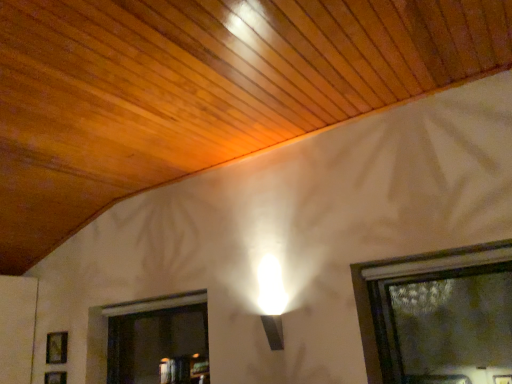
What do you see at coordinates (55, 377) in the screenshot?
I see `wooden picture frame at lower left, which is the 1th picture frame in bottom-to-top order` at bounding box center [55, 377].

Find the location of `wooden picture frame at lower left, acting as the 2th picture frame starting from the top`. wooden picture frame at lower left, acting as the 2th picture frame starting from the top is located at coordinates (55, 377).

I want to click on wooden frame at lower left, placed as the first picture frame when sorted from top to bottom, so click(x=56, y=347).

Image resolution: width=512 pixels, height=384 pixels. What do you see at coordinates (56, 347) in the screenshot?
I see `wooden frame at lower left, placed as the first picture frame when sorted from top to bottom` at bounding box center [56, 347].

Identify the location of wooden picture frame at lower left, acting as the 2th picture frame starting from the top. (55, 377).

Considering the positions of objects wooden picture frame at lower left, which is the 1th picture frame in bottom-to-top order, and wooden frame at lower left, which is the 2th picture frame from bottom to top, in the image provided, who is more to the right, wooden picture frame at lower left, which is the 1th picture frame in bottom-to-top order, or wooden frame at lower left, which is the 2th picture frame from bottom to top,?

wooden picture frame at lower left, which is the 1th picture frame in bottom-to-top order, is more to the right.

Is the depth of wooden picture frame at lower left, acting as the 2th picture frame starting from the top, greater than that of wooden frame at lower left, which is the 2th picture frame from bottom to top?

No, wooden picture frame at lower left, acting as the 2th picture frame starting from the top, is in front of wooden frame at lower left, which is the 2th picture frame from bottom to top.

Which is farther from the camera, (66, 372) or (57, 352)?

Point (57, 352)

From the image's perspective, between wooden picture frame at lower left, acting as the 2th picture frame starting from the top, and wooden frame at lower left, which is the 2th picture frame from bottom to top, which one is located above?

From the image's view, wooden frame at lower left, which is the 2th picture frame from bottom to top, is above.

From a real-world perspective, is wooden picture frame at lower left, acting as the 2th picture frame starting from the top, beneath wooden frame at lower left, placed as the first picture frame when sorted from top to bottom?

Indeed, from a real-world perspective, wooden picture frame at lower left, acting as the 2th picture frame starting from the top, is positioned beneath wooden frame at lower left, placed as the first picture frame when sorted from top to bottom.

Is wooden picture frame at lower left, which is the 1th picture frame in bottom-to-top order, wider than wooden frame at lower left, placed as the first picture frame when sorted from top to bottom?

In fact, wooden picture frame at lower left, which is the 1th picture frame in bottom-to-top order, might be narrower than wooden frame at lower left, placed as the first picture frame when sorted from top to bottom.

Is wooden picture frame at lower left, which is the 1th picture frame in bottom-to-top order, taller or shorter than wooden frame at lower left, placed as the first picture frame when sorted from top to bottom?

Clearly, wooden picture frame at lower left, which is the 1th picture frame in bottom-to-top order, is shorter compared to wooden frame at lower left, placed as the first picture frame when sorted from top to bottom.

Between wooden picture frame at lower left, acting as the 2th picture frame starting from the top, and wooden frame at lower left, which is the 2th picture frame from bottom to top, which one has larger size?

With larger size is wooden frame at lower left, which is the 2th picture frame from bottom to top.

Is wooden picture frame at lower left, acting as the 2th picture frame starting from the top, located outside wooden frame at lower left, placed as the first picture frame when sorted from top to bottom?

Absolutely, wooden picture frame at lower left, acting as the 2th picture frame starting from the top, is external to wooden frame at lower left, placed as the first picture frame when sorted from top to bottom.

Is wooden picture frame at lower left, acting as the 2th picture frame starting from the top, touching wooden frame at lower left, placed as the first picture frame when sorted from top to bottom?

wooden picture frame at lower left, acting as the 2th picture frame starting from the top, is not next to wooden frame at lower left, placed as the first picture frame when sorted from top to bottom, and they're not touching.

Is wooden picture frame at lower left, acting as the 2th picture frame starting from the top, looking in the opposite direction of wooden frame at lower left, placed as the first picture frame when sorted from top to bottom?

That's not correct — wooden picture frame at lower left, acting as the 2th picture frame starting from the top, is not looking away from wooden frame at lower left, placed as the first picture frame when sorted from top to bottom.

The height and width of the screenshot is (384, 512). In order to click on picture frame lying above the wooden picture frame at lower left, acting as the 2th picture frame starting from the top (from the image's perspective) in this screenshot , I will do `click(56, 347)`.

Which object is positioned more to the right, wooden frame at lower left, which is the 2th picture frame from bottom to top, or wooden picture frame at lower left, which is the 1th picture frame in bottom-to-top order?

wooden picture frame at lower left, which is the 1th picture frame in bottom-to-top order.

Which object is closer to the camera, wooden frame at lower left, which is the 2th picture frame from bottom to top, or wooden picture frame at lower left, acting as the 2th picture frame starting from the top?

Positioned in front is wooden picture frame at lower left, acting as the 2th picture frame starting from the top.

Which is in front, point (67, 336) or point (50, 381)?

The point (50, 381) is more forward.

From the image's perspective, which one is positioned lower, wooden frame at lower left, placed as the first picture frame when sorted from top to bottom, or wooden picture frame at lower left, which is the 1th picture frame in bottom-to-top order?

wooden picture frame at lower left, which is the 1th picture frame in bottom-to-top order, from the image's perspective.

From a real-world perspective, is wooden frame at lower left, placed as the first picture frame when sorted from top to bottom, physically below wooden picture frame at lower left, which is the 1th picture frame in bottom-to-top order?

No, from a real-world perspective, wooden frame at lower left, placed as the first picture frame when sorted from top to bottom, is not under wooden picture frame at lower left, which is the 1th picture frame in bottom-to-top order.

Considering the sizes of objects wooden frame at lower left, placed as the first picture frame when sorted from top to bottom, and wooden picture frame at lower left, which is the 1th picture frame in bottom-to-top order, in the image provided, who is wider, wooden frame at lower left, placed as the first picture frame when sorted from top to bottom, or wooden picture frame at lower left, which is the 1th picture frame in bottom-to-top order,?

With larger width is wooden frame at lower left, placed as the first picture frame when sorted from top to bottom.

Considering the sizes of wooden frame at lower left, placed as the first picture frame when sorted from top to bottom, and wooden picture frame at lower left, which is the 1th picture frame in bottom-to-top order, in the image, is wooden frame at lower left, placed as the first picture frame when sorted from top to bottom, taller or shorter than wooden picture frame at lower left, which is the 1th picture frame in bottom-to-top order,?

Considering their sizes, wooden frame at lower left, placed as the first picture frame when sorted from top to bottom, has more height than wooden picture frame at lower left, which is the 1th picture frame in bottom-to-top order.

Is wooden frame at lower left, which is the 2th picture frame from bottom to top, bigger than wooden picture frame at lower left, which is the 1th picture frame in bottom-to-top order?

Yes.

Would you say wooden frame at lower left, placed as the first picture frame when sorted from top to bottom, contains wooden picture frame at lower left, acting as the 2th picture frame starting from the top?

That's incorrect, wooden picture frame at lower left, acting as the 2th picture frame starting from the top, is not inside wooden frame at lower left, placed as the first picture frame when sorted from top to bottom.

Are wooden frame at lower left, placed as the first picture frame when sorted from top to bottom, and wooden picture frame at lower left, which is the 1th picture frame in bottom-to-top order, making contact?

No.

Could you tell me if wooden frame at lower left, placed as the first picture frame when sorted from top to bottom, is facing wooden picture frame at lower left, acting as the 2th picture frame starting from the top?

No, wooden frame at lower left, placed as the first picture frame when sorted from top to bottom, is not aimed at wooden picture frame at lower left, acting as the 2th picture frame starting from the top.

Can you tell me how much wooden frame at lower left, placed as the first picture frame when sorted from top to bottom, and wooden picture frame at lower left, acting as the 2th picture frame starting from the top, differ in facing direction?

The facing directions of wooden frame at lower left, placed as the first picture frame when sorted from top to bottom, and wooden picture frame at lower left, acting as the 2th picture frame starting from the top, are 0.00177 degrees apart.

I want to click on picture frame lying on the right of wooden frame at lower left, placed as the first picture frame when sorted from top to bottom, so point(55,377).

The height and width of the screenshot is (384, 512). Identify the location of picture frame above the wooden picture frame at lower left, acting as the 2th picture frame starting from the top (from the image's perspective). (56, 347).

Identify the location of picture frame in front of the wooden frame at lower left, which is the 2th picture frame from bottom to top. This screenshot has height=384, width=512. (55, 377).